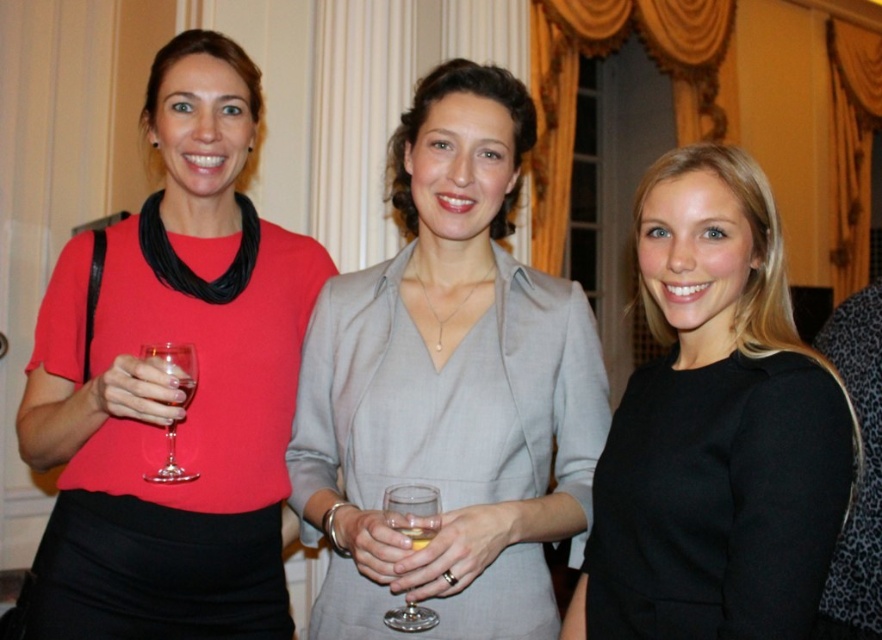
You are a photographer adjusting the camera focus. You need to ensure that both the matte red blouse at left and the transparent glass at center are in focus. Which object should you focus on first to ensure depth of field covers both?

The matte red blouse at left is taller than the transparent glass at center, so focusing on the taller object first will help ensure the depth of field includes both.

You are standing in the room where the three women are. You want to take a photo of the point at coordinate (170, 356). Is this point within your current field of view?

Yes, the point at coordinate (170, 356) is within your current field of view because it is only 1.33 meters away from the viewer.